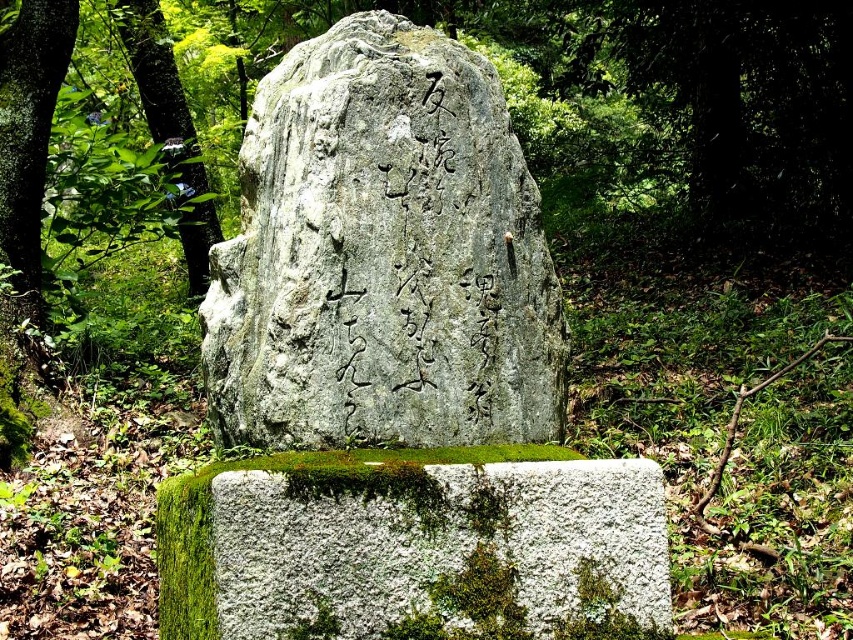
Is the position of gray stone boulder at center less distant than that of green mossy stone at center?

No, gray stone boulder at center is behind green mossy stone at center.

Which is more to the right, gray stone boulder at center or green mossy stone at center?

gray stone boulder at center

Describe the element at coordinates (383, 256) in the screenshot. I see `gray stone boulder at center` at that location.

The height and width of the screenshot is (640, 853). I want to click on gray stone boulder at center, so click(x=383, y=256).

Can you confirm if gray stone boulder at center is thinner than green leafy tree at left?

Incorrect, gray stone boulder at center's width is not less than green leafy tree at left's.

Find the location of a particular element. gray stone boulder at center is located at coordinates (383, 256).

Is point (381, 301) positioned before point (171, 173)?

Yes, it is.

Image resolution: width=853 pixels, height=640 pixels. In order to click on gray stone boulder at center in this screenshot , I will do `click(383, 256)`.

Who is shorter, green mossy stone at center or green leafy tree at left?

Standing shorter between the two is green mossy stone at center.

Does green mossy stone at center have a smaller size compared to green leafy tree at left?

Indeed, green mossy stone at center has a smaller size compared to green leafy tree at left.

Is point (613, 512) positioned in front of point (177, 156)?

That is True.

The height and width of the screenshot is (640, 853). What are the coordinates of `green mossy stone at center` in the screenshot? It's located at (412, 545).